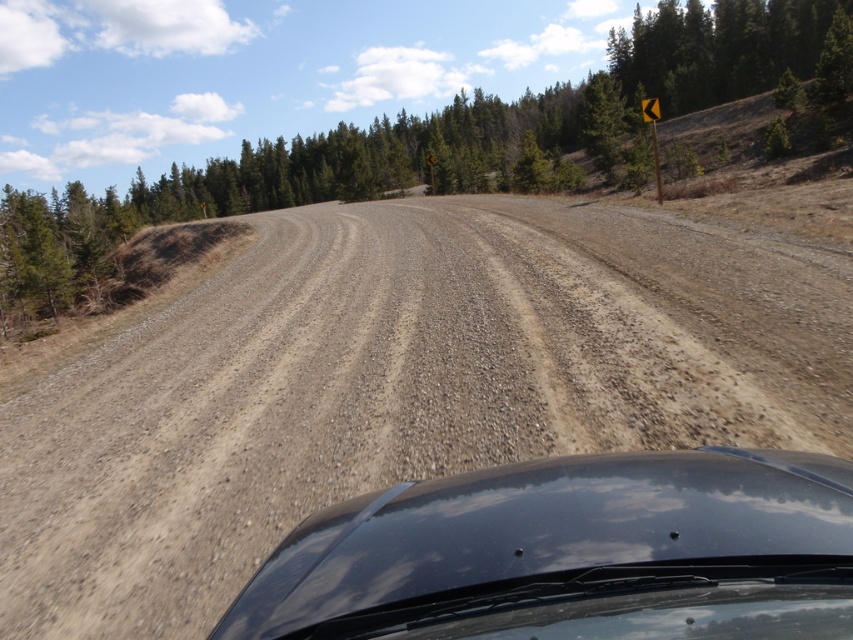
Question: Which object is closer to the camera taking this photo?

Choices:
 (A) glossy black car at center
 (B) dusty gravel road at center

Answer: (A)

Question: Does dusty gravel road at center have a larger size compared to glossy black car at center?

Choices:
 (A) no
 (B) yes

Answer: (B)

Question: Which of the following is the closest to the observer?

Choices:
 (A) glossy black car at center
 (B) dusty gravel road at center

Answer: (A)

Question: Can you confirm if dusty gravel road at center is bigger than glossy black car at center?

Choices:
 (A) yes
 (B) no

Answer: (A)

Question: Is dusty gravel road at center thinner than glossy black car at center?

Choices:
 (A) yes
 (B) no

Answer: (B)